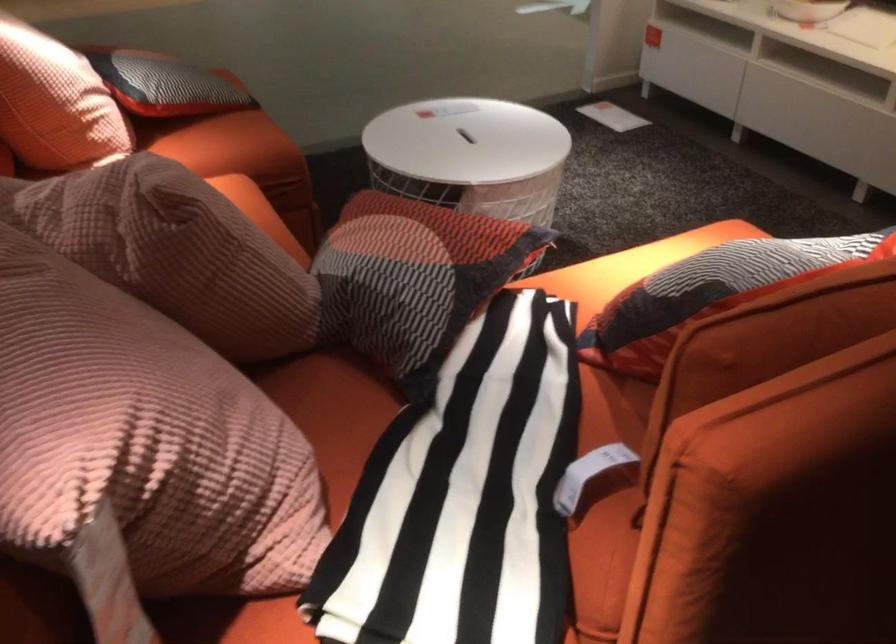
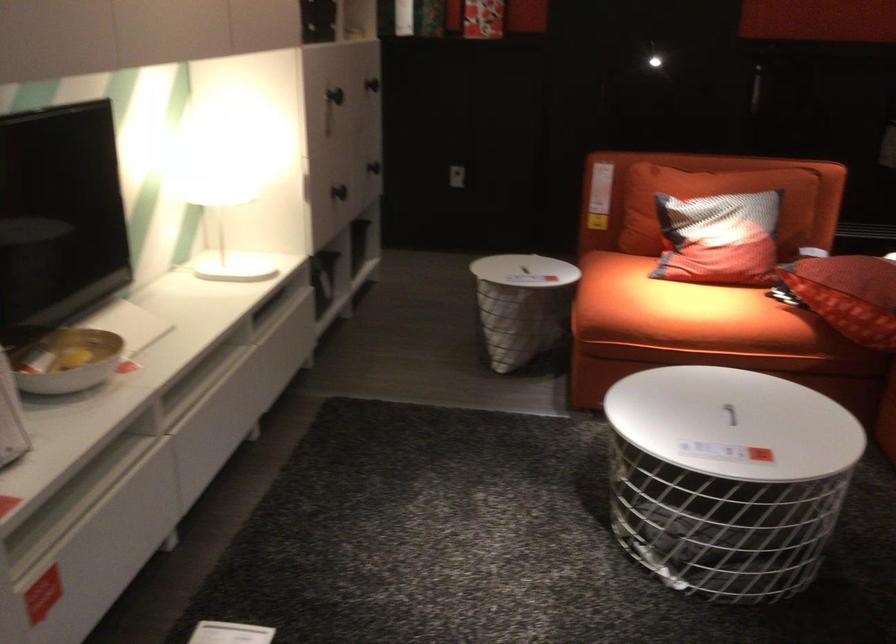
The point at (460,145) is marked in the first image. Where is the corresponding point in the second image?

(729, 413)